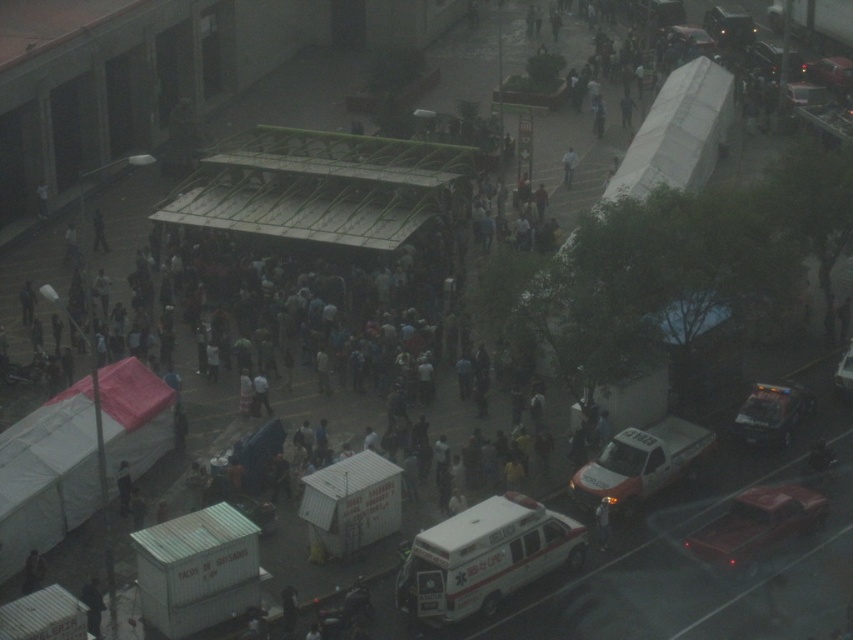
Question: Which of the following is the closest to the observer?

Choices:
 (A) white matte ambulance at center-right
 (B) white glossy ambulance at center
 (C) dark gray uniform at center

Answer: (B)

Question: Is white fabric canopy at lower left closer to the viewer compared to white glossy ambulance at center?

Choices:
 (A) yes
 (B) no

Answer: (B)

Question: Which point is farther to the camera?

Choices:
 (A) (0, 532)
 (B) (604, 502)

Answer: (B)

Question: Estimate the real-world distances between objects in this image. Which object is closer to the white fabric canopy at lower left?

Choices:
 (A) white matte ambulance at center-right
 (B) dark gray uniform at center
 (C) white glossy ambulance at center

Answer: (C)

Question: Can you confirm if white fabric canopy at lower left is thinner than white matte ambulance at center-right?

Choices:
 (A) yes
 (B) no

Answer: (A)

Question: From the image, what is the correct spatial relationship of white matte ambulance at center-right in relation to dark gray uniform at center?

Choices:
 (A) above
 (B) below

Answer: (A)